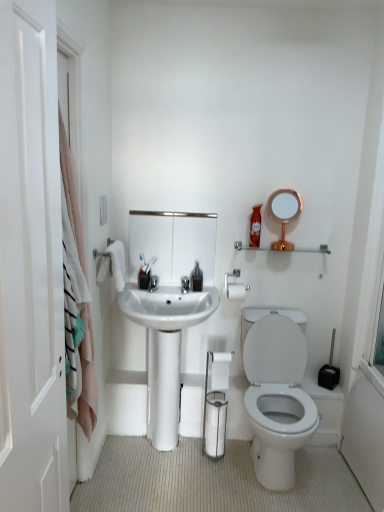
Question: Considering the relative sizes of pink fabric towel at left and metallic rectangular mirror at center, which is the 1th mirror in left-to-right order, in the image provided, is pink fabric towel at left bigger than metallic rectangular mirror at center, which is the 1th mirror in left-to-right order,?

Choices:
 (A) no
 (B) yes

Answer: (A)

Question: Is pink fabric towel at left beside metallic rectangular mirror at center, positioned as the 2th mirror in right-to-left order?

Choices:
 (A) no
 (B) yes

Answer: (A)

Question: Is pink fabric towel at left looking in the opposite direction of metallic rectangular mirror at center, which is the 1th mirror in left-to-right order?

Choices:
 (A) no
 (B) yes

Answer: (A)

Question: Can you confirm if pink fabric towel at left is wider than metallic rectangular mirror at center, which is the 1th mirror in left-to-right order?

Choices:
 (A) no
 (B) yes

Answer: (B)

Question: Does pink fabric towel at left appear on the left side of metallic rectangular mirror at center, which is the 1th mirror in left-to-right order?

Choices:
 (A) no
 (B) yes

Answer: (B)

Question: Considering the relative sizes of pink fabric towel at left and metallic rectangular mirror at center, which is the 1th mirror in left-to-right order, in the image provided, is pink fabric towel at left thinner than metallic rectangular mirror at center, which is the 1th mirror in left-to-right order,?

Choices:
 (A) yes
 (B) no

Answer: (B)

Question: Is pink fabric towel at left touching white matte toilet paper at center?

Choices:
 (A) no
 (B) yes

Answer: (A)

Question: Is pink fabric towel at left smaller than white matte toilet paper at center?

Choices:
 (A) no
 (B) yes

Answer: (A)

Question: Is pink fabric towel at left outside of white matte toilet paper at center?

Choices:
 (A) yes
 (B) no

Answer: (A)

Question: Is pink fabric towel at left shorter than white matte toilet paper at center?

Choices:
 (A) no
 (B) yes

Answer: (A)

Question: Can you confirm if pink fabric towel at left is thinner than white matte toilet paper at center?

Choices:
 (A) yes
 (B) no

Answer: (B)

Question: Is white matte toilet paper at center inside pink fabric towel at left?

Choices:
 (A) no
 (B) yes

Answer: (A)

Question: Is pink fabric towel at left surrounded by rose gold metallic mirror at upper right, acting as the 1th mirror starting from the right?

Choices:
 (A) yes
 (B) no

Answer: (B)